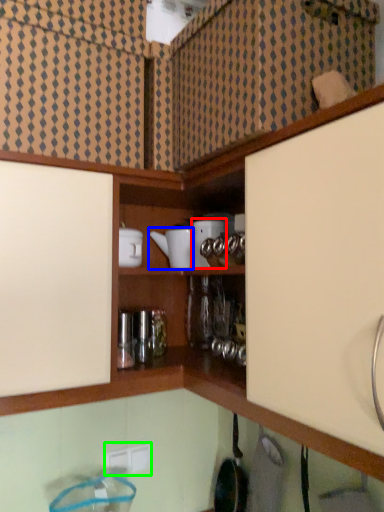
Question: Based on their relative distances, which object is nearer to appliance (highlighted by a red box)? Choose from appliance (highlighted by a blue box) and electric outlet (highlighted by a green box).

Choices:
 (A) appliance
 (B) electric outlet

Answer: (A)